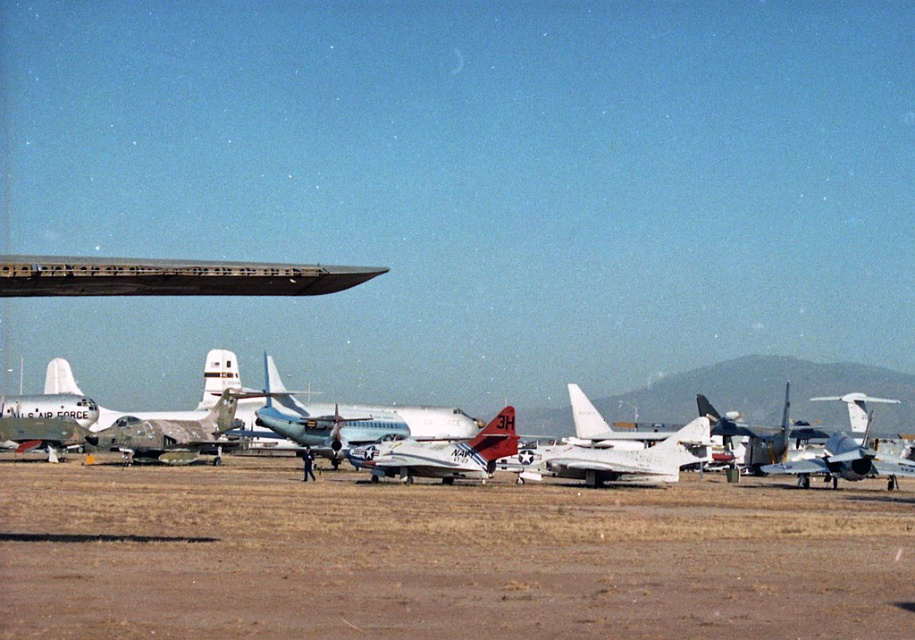
You are planning to move the silver metallic airplane at center to another location. Given the space available on the brown dirt field at center, do you think the airplane will fit if rotated 90 degrees?

The brown dirt field at center has a lesser width compared to the silver metallic airplane at center. Rotating the airplane 90 degrees would require more width, so it may not fit within the available space on the brown dirt field at center.

You are a photographer standing on the brown dirt field at center and want to take a photo of the silver metallic airplane at center. Since you are on the field, can you move closer to the airplane without any obstacles between you and the airplane?

The brown dirt field at center is in front of the silver metallic airplane at center, so there are no obstacles between you and the airplane. You can move closer to take the photo.